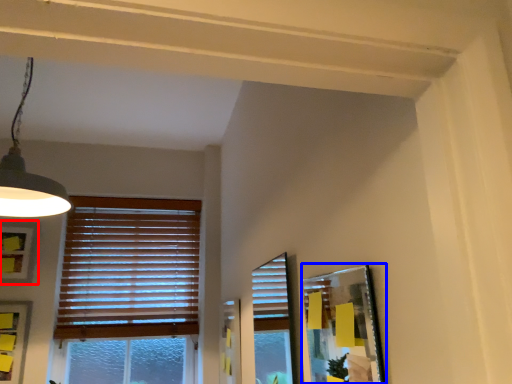
Question: Among these objects, which one is farthest to the camera, picture frame (highlighted by a red box) or picture frame (highlighted by a blue box)?

Choices:
 (A) picture frame
 (B) picture frame

Answer: (A)